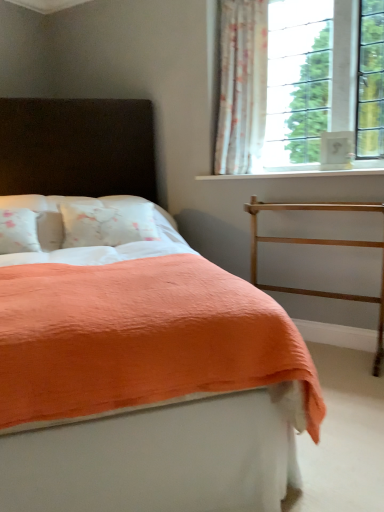
Image resolution: width=384 pixels, height=512 pixels. Describe the element at coordinates (319, 244) in the screenshot. I see `gold metallic balustrade at right` at that location.

In order to face coral fabric bed at center, should I rotate leftwards or rightwards?

Turn left by 14.591 degrees to look at coral fabric bed at center.

Image resolution: width=384 pixels, height=512 pixels. Describe the element at coordinates (144, 382) in the screenshot. I see `coral fabric bed at center` at that location.

Where is `white smooth window sill at upper right`? Image resolution: width=384 pixels, height=512 pixels. white smooth window sill at upper right is located at coordinates [299, 174].

Based on their positions, is white smooth window sill at upper right located to the left or right of white floral fabric curtain at upper right?

Based on their positions, white smooth window sill at upper right is located to the right of white floral fabric curtain at upper right.

Does white smooth window sill at upper right have a smaller size compared to white floral fabric curtain at upper right?

Yes.

From the image's perspective, which is below, white smooth window sill at upper right or white floral fabric curtain at upper right?

white smooth window sill at upper right, from the image's perspective.

Would you say gold metallic balustrade at right contains white smooth window sill at upper right?

Definitely not — white smooth window sill at upper right is not inside gold metallic balustrade at right.

Based on the photo, would you say gold metallic balustrade at right is to the left or to the right of white smooth window sill at upper right in the picture?

Based on their positions, gold metallic balustrade at right is located to the right of white smooth window sill at upper right.

Considering the sizes of gold metallic balustrade at right and white smooth window sill at upper right in the image, is gold metallic balustrade at right wider or thinner than white smooth window sill at upper right?

Clearly, gold metallic balustrade at right has less width compared to white smooth window sill at upper right.

Is point (238, 97) farther from camera compared to point (317, 239)?

Yes, point (238, 97) is behind point (317, 239).

Is white floral fabric curtain at upper right oriented towards gold metallic balustrade at right?

No.

At what (x,y) coordinates should I click in order to perform the action: click on balustrade below the white floral fabric curtain at upper right (from a real-world perspective). Please return your answer as a coordinate pair (x, y). Looking at the image, I should click on (319, 244).

Looking at this image, how many degrees apart are the facing directions of white floral fabric curtain at upper right and gold metallic balustrade at right?

0.000997 degrees separate the facing orientations of white floral fabric curtain at upper right and gold metallic balustrade at right.

From a real-world perspective, between white floral fabric curtain at upper right and white smooth window sill at upper right, who is vertically lower?

white smooth window sill at upper right is physically lower.

Considering the relative sizes of white floral fabric curtain at upper right and white smooth window sill at upper right in the image provided, is white floral fabric curtain at upper right taller than white smooth window sill at upper right?

Yes.

Is white floral fabric curtain at upper right inside or outside of white smooth window sill at upper right?

white floral fabric curtain at upper right is not inside white smooth window sill at upper right, it's outside.

Does white smooth window sill at upper right turn towards gold metallic balustrade at right?

No, white smooth window sill at upper right is not facing towards gold metallic balustrade at right.

Considering the positions of points (289, 175) and (358, 301), is point (289, 175) farther from camera compared to point (358, 301)?

That is True.

Is white smooth window sill at upper right with gold metallic balustrade at right?

No, white smooth window sill at upper right is not with gold metallic balustrade at right.

Is white smooth window sill at upper right to the left of gold metallic balustrade at right from the viewer's perspective?

Yes.

Between coral fabric bed at center and white floral fabric curtain at upper right, which one is positioned behind?

white floral fabric curtain at upper right is further from the camera.

Is coral fabric bed at center positioned far away from white floral fabric curtain at upper right?

Yes, coral fabric bed at center and white floral fabric curtain at upper right are located far from each other.

Can you confirm if coral fabric bed at center is taller than white floral fabric curtain at upper right?

Indeed, coral fabric bed at center has a greater height compared to white floral fabric curtain at upper right.

Is coral fabric bed at center not within white floral fabric curtain at upper right?

That's correct, coral fabric bed at center is outside of white floral fabric curtain at upper right.

How different are the orientations of white smooth window sill at upper right and coral fabric bed at center in degrees?

white smooth window sill at upper right and coral fabric bed at center are facing 45.7 degrees away from each other.

Between white smooth window sill at upper right and coral fabric bed at center, which one has larger size?

With larger size is coral fabric bed at center.

Does white smooth window sill at upper right have a lesser height compared to coral fabric bed at center?

Indeed, white smooth window sill at upper right has a lesser height compared to coral fabric bed at center.

Is the depth of white smooth window sill at upper right greater than that of coral fabric bed at center?

Yes, it is behind coral fabric bed at center.

At what (x,y) coordinates should I click in order to perform the action: click on curtain on the left of white smooth window sill at upper right. Please return your answer as a coordinate pair (x, y). Looking at the image, I should click on (242, 85).

At what (x,y) coordinates should I click in order to perform the action: click on balustrade on the right of white smooth window sill at upper right. Please return your answer as a coordinate pair (x, y). Looking at the image, I should click on (319, 244).

Considering their positions, is white smooth window sill at upper right positioned further to coral fabric bed at center than gold metallic balustrade at right?

white smooth window sill at upper right.

From the image, which object appears to be farther from white smooth window sill at upper right, gold metallic balustrade at right or coral fabric bed at center?

coral fabric bed at center is further to white smooth window sill at upper right.

Which object lies further to the anchor point white floral fabric curtain at upper right, coral fabric bed at center or gold metallic balustrade at right?

coral fabric bed at center lies further to white floral fabric curtain at upper right than the other object.

Considering their positions, is gold metallic balustrade at right positioned further to coral fabric bed at center than white smooth window sill at upper right?

The object further to coral fabric bed at center is white smooth window sill at upper right.

Looking at the image, which one is located closer to coral fabric bed at center, white floral fabric curtain at upper right or white smooth window sill at upper right?

Based on the image, white smooth window sill at upper right appears to be nearer to coral fabric bed at center.

Considering their positions, is white floral fabric curtain at upper right positioned closer to coral fabric bed at center than gold metallic balustrade at right?

The object closer to coral fabric bed at center is gold metallic balustrade at right.

Based on their spatial positions, is white floral fabric curtain at upper right or gold metallic balustrade at right closer to white smooth window sill at upper right?

Among the two, gold metallic balustrade at right is located nearer to white smooth window sill at upper right.

From the image, which object appears to be farther from white smooth window sill at upper right, coral fabric bed at center or gold metallic balustrade at right?

Among the two, coral fabric bed at center is located further to white smooth window sill at upper right.

At what (x,y) coordinates should I click in order to perform the action: click on window sill between white floral fabric curtain at upper right and gold metallic balustrade at right from top to bottom. Please return your answer as a coordinate pair (x, y). The width and height of the screenshot is (384, 512). Looking at the image, I should click on (299, 174).

The height and width of the screenshot is (512, 384). I want to click on balustrade between coral fabric bed at center and white smooth window sill at upper right along the z-axis, so click(319, 244).

I want to click on balustrade between coral fabric bed at center and white floral fabric curtain at upper right along the z-axis, so click(x=319, y=244).

At what (x,y) coordinates should I click in order to perform the action: click on window sill between coral fabric bed at center and white floral fabric curtain at upper right in the front-back direction. Please return your answer as a coordinate pair (x, y). The height and width of the screenshot is (512, 384). Looking at the image, I should click on (299, 174).